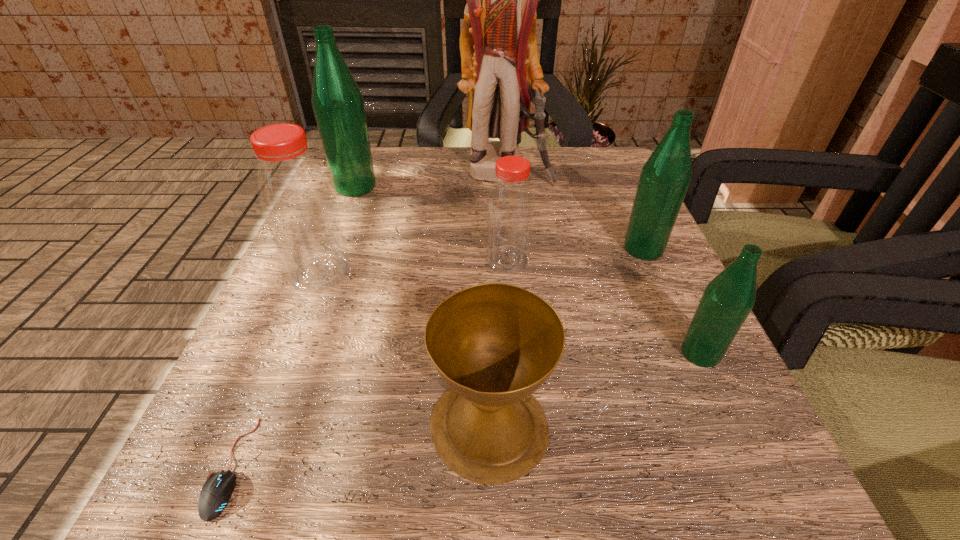
The height and width of the screenshot is (540, 960). I want to click on free spot at the far edge of the desktop, so click(x=469, y=152).

The image size is (960, 540). Identify the location of vacant space at the near edge of the desktop. (428, 458).

You are a GUI agent. You are given a task and a screenshot of the screen. Output one action in this format:
    pyautogui.click(x=<x>, y=<y>)
    Task: Click on the free space at the left edge
    Image resolution: width=960 pixels, height=540 pixels.
    Given the screenshot: What is the action you would take?
    pyautogui.click(x=341, y=377)

Identify the location of free spot at the right edge of the desktop. The image size is (960, 540). (586, 207).

I want to click on blank space at the far left corner, so click(365, 197).

Where is `vacant space at the far right corner`? This screenshot has height=540, width=960. vacant space at the far right corner is located at coordinates (615, 156).

In the image, there is a desktop. Where is `vacant region at the near right corner`? vacant region at the near right corner is located at coordinates (696, 500).

At what (x,y) coordinates should I click in order to perform the action: click on vacant region between the nutcracker and the shortest object. Please return your answer as a coordinate pair (x, y). The width and height of the screenshot is (960, 540). Looking at the image, I should click on (369, 320).

Identify the location of free space between the smaller red bottle and the second tallest object. Image resolution: width=960 pixels, height=540 pixels. click(432, 224).

I want to click on empty space that is in between the mouse and the biggest green bottle, so click(x=293, y=326).